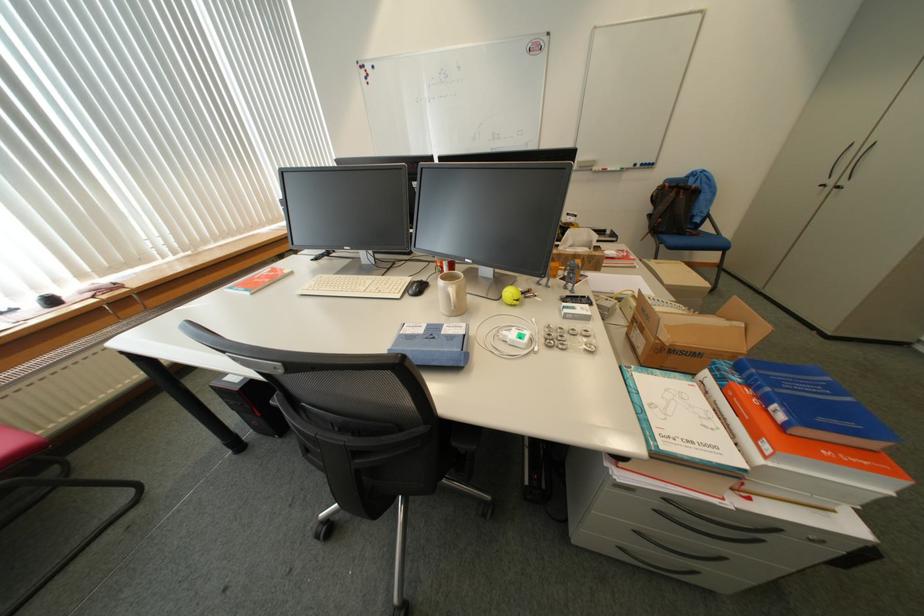
Identify the location of open cardboard box. (691, 334).